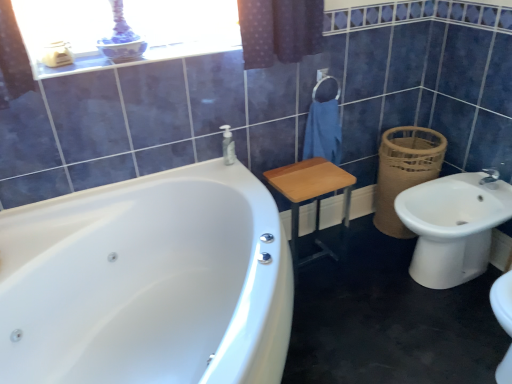
You are a GUI agent. You are given a task and a screenshot of the screen. Output one action in this format:
    pyautogui.click(x=<x>, y=<y>)
    Task: Click on the free space on the front side of wooden stool at center
    Image resolution: width=512 pixels, height=384 pixels.
    Given the screenshot: What is the action you would take?
    pyautogui.click(x=331, y=301)